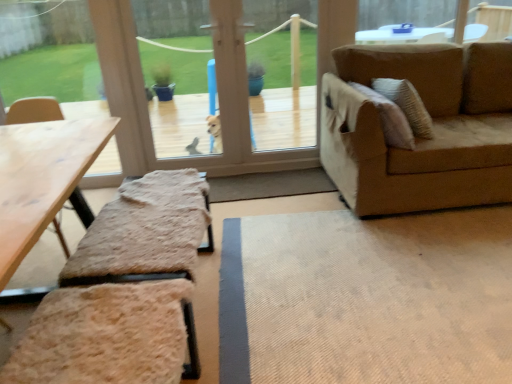
Describe the element at coordinates (282, 89) in the screenshot. Image resolution: width=512 pixels, height=384 pixels. I see `transparent plastic dog at center` at that location.

Identify the location of transparent plastic dog at center. (282, 89).

From the picture: Measure the distance between wooden picnic table at lower left and camera.

33.23 inches.

What do you see at coordinates (42, 181) in the screenshot? This screenshot has height=384, width=512. I see `wooden picnic table at lower left` at bounding box center [42, 181].

Where is `wooden picnic table at lower left`? wooden picnic table at lower left is located at coordinates (42, 181).

Where is `transparent plastic dog at center`? Image resolution: width=512 pixels, height=384 pixels. transparent plastic dog at center is located at coordinates (282, 89).

Between transparent plastic dog at center and wooden picnic table at lower left, which one appears on the right side from the viewer's perspective?

transparent plastic dog at center.

Considering their positions, is transparent plastic dog at center located in front of or behind wooden picnic table at lower left?

transparent plastic dog at center is behind wooden picnic table at lower left.

Is point (158, 118) behind point (42, 183)?

Yes, point (158, 118) is farther from viewer.

From the image's perspective, between transparent plastic dog at center and wooden picnic table at lower left, who is located below?

wooden picnic table at lower left, from the image's perspective.

From a real-world perspective, is transparent plastic dog at center above or below wooden picnic table at lower left?

In terms of real-world spatial position, transparent plastic dog at center is above wooden picnic table at lower left.

Considering the relative sizes of transparent plastic dog at center and wooden picnic table at lower left in the image provided, is transparent plastic dog at center wider than wooden picnic table at lower left?

Incorrect, the width of transparent plastic dog at center does not surpass that of wooden picnic table at lower left.

Considering the relative sizes of transparent plastic dog at center and wooden picnic table at lower left in the image provided, is transparent plastic dog at center taller than wooden picnic table at lower left?

Yes.

Considering the relative sizes of transparent plastic dog at center and wooden picnic table at lower left in the image provided, is transparent plastic dog at center smaller than wooden picnic table at lower left?

Yes.

Is transparent plastic dog at center not within wooden picnic table at lower left?

Yes.

Is transparent plastic dog at center far from wooden picnic table at lower left?

That's right, there is a large distance between transparent plastic dog at center and wooden picnic table at lower left.

Does transparent plastic dog at center turn towards wooden picnic table at lower left?

Yes, transparent plastic dog at center faces towards wooden picnic table at lower left.

Locate an element on the screen. This screenshot has width=512, height=384. picnic table below the transparent plastic dog at center (from the image's perspective) is located at coordinates (42, 181).

Which is more to the left, wooden picnic table at lower left or transparent plastic dog at center?

wooden picnic table at lower left.

Considering the positions of objects wooden picnic table at lower left and transparent plastic dog at center in the image provided, who is behind, wooden picnic table at lower left or transparent plastic dog at center?

Positioned behind is transparent plastic dog at center.

Consider the image. Which is farther, [30,172] or [264,48]?

The point [264,48] is farther from the camera.

From the image's perspective, does wooden picnic table at lower left appear higher than transparent plastic dog at center?

No, from the image's perspective, wooden picnic table at lower left is not above transparent plastic dog at center.

From a real-world perspective, which is physically below, wooden picnic table at lower left or transparent plastic dog at center?

From a 3D spatial view, wooden picnic table at lower left is below.

Which object is thinner, wooden picnic table at lower left or transparent plastic dog at center?

Thinner between the two is transparent plastic dog at center.

In terms of height, does wooden picnic table at lower left look taller or shorter compared to transparent plastic dog at center?

wooden picnic table at lower left is shorter than transparent plastic dog at center.

Considering the sizes of objects wooden picnic table at lower left and transparent plastic dog at center in the image provided, who is smaller, wooden picnic table at lower left or transparent plastic dog at center?

With smaller size is transparent plastic dog at center.

Can we say wooden picnic table at lower left lies outside transparent plastic dog at center?

That's correct, wooden picnic table at lower left is outside of transparent plastic dog at center.

Is wooden picnic table at lower left directly adjacent to transparent plastic dog at center?

No, wooden picnic table at lower left is not with transparent plastic dog at center.

Is wooden picnic table at lower left oriented towards transparent plastic dog at center?

No, wooden picnic table at lower left is not oriented towards transparent plastic dog at center.

Can you tell me how much wooden picnic table at lower left and transparent plastic dog at center differ in facing direction?

89.3 degrees separate the facing orientations of wooden picnic table at lower left and transparent plastic dog at center.

Image resolution: width=512 pixels, height=384 pixels. In the image, there is a transparent plastic dog at center. Identify the location of picnic table below it (from a real-world perspective). (42, 181).

You are a GUI agent. You are given a task and a screenshot of the screen. Output one action in this format:
    pyautogui.click(x=<x>, y=<y>)
    Task: Click on the window screen on the right side of wooden picnic table at lower left
    
    Given the screenshot: What is the action you would take?
    pyautogui.click(x=282, y=89)

The height and width of the screenshot is (384, 512). Find the location of `window screen that appears behind the wooden picnic table at lower left`. window screen that appears behind the wooden picnic table at lower left is located at coordinates (282, 89).